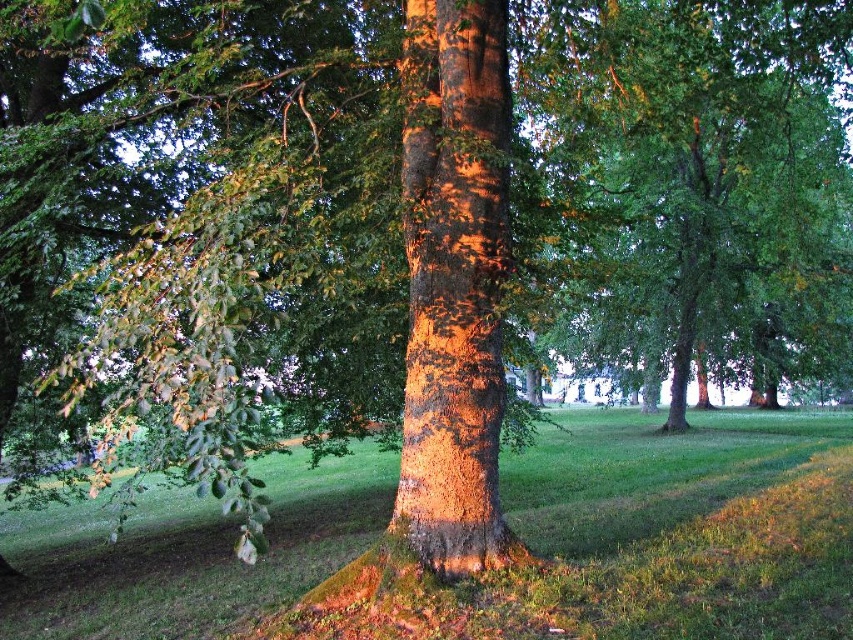
Can you confirm if green leafy tree at center is smaller than shiny brown bark at center?

Actually, green leafy tree at center might be larger than shiny brown bark at center.

Does green leafy tree at center have a greater height compared to shiny brown bark at center?

Yes, green leafy tree at center is taller than shiny brown bark at center.

Which is behind, point (666, 300) or point (442, 492)?

Point (666, 300)

Locate an element on the screen. This screenshot has width=853, height=640. green leafy tree at center is located at coordinates (701, 173).

Measure the distance between green grassy at center and shiny brown bark at center.

green grassy at center and shiny brown bark at center are 27.83 feet apart.

Is green grassy at center further to camera compared to shiny brown bark at center?

No, it is in front of shiny brown bark at center.

The image size is (853, 640). Find the location of `green grassy at center`. green grassy at center is located at coordinates (695, 518).

Find the location of a particular element. green grassy at center is located at coordinates (695, 518).

Can you confirm if green grassy at center is positioned to the left of green leafy tree at center?

Yes, green grassy at center is to the left of green leafy tree at center.

Between point (531, 531) and point (834, 346), which one is positioned in front?

Point (531, 531) is in front.

Does point (28, 516) come in front of point (827, 273)?

Yes, point (28, 516) is closer to viewer.

I want to click on green grassy at center, so click(x=695, y=518).